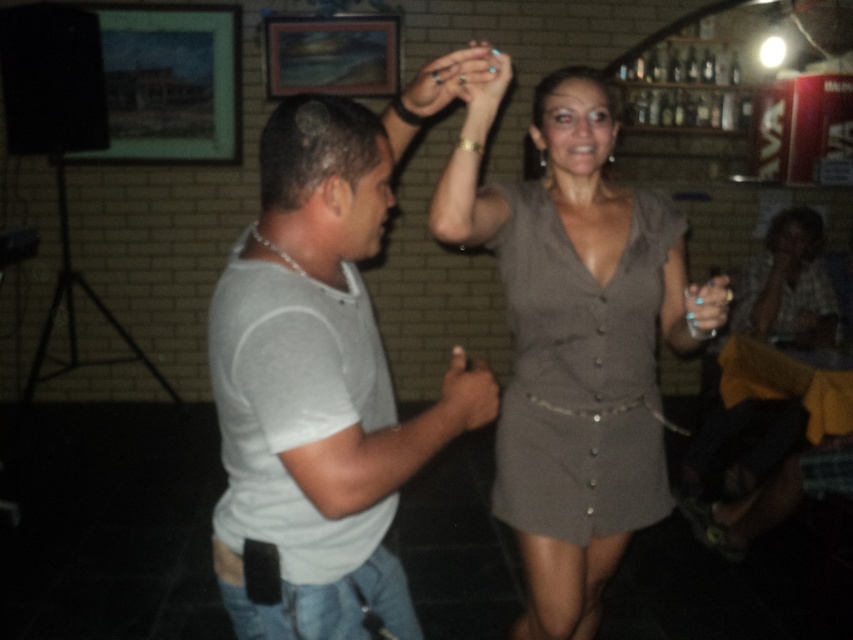
Question: Which object appears closest to the camera in this image?

Choices:
 (A) matte gray hand at center
 (B) matte gray dress at center
 (C) gray matte dress at center
 (D) white matte t-shirt at center

Answer: (D)

Question: Among these objects, which one is farthest from the camera?

Choices:
 (A) white matte t-shirt at center
 (B) gray matte dress at center
 (C) matte silver ring at upper center

Answer: (B)

Question: Is gray matte dress at center wider than matte silver ring at upper center?

Choices:
 (A) yes
 (B) no

Answer: (A)

Question: Observing the image, what is the correct spatial positioning of matte gray hand at center in reference to matte silver ring at upper center?

Choices:
 (A) left
 (B) right

Answer: (A)

Question: Can you confirm if matte gray dress at center is wider than matte silver ring at upper center?

Choices:
 (A) no
 (B) yes

Answer: (B)

Question: Which point is closer to the camera taking this photo?

Choices:
 (A) (540, 188)
 (B) (480, 426)
 (C) (498, 500)
 (D) (473, 76)

Answer: (B)